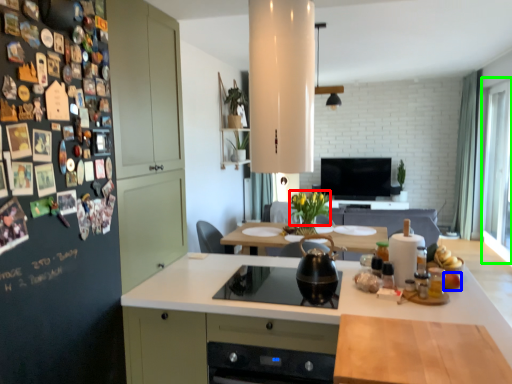
Question: Which is nearer to the flower (highlighted by a red box)? food (highlighted by a blue box) or window (highlighted by a green box).

Choices:
 (A) food
 (B) window

Answer: (A)